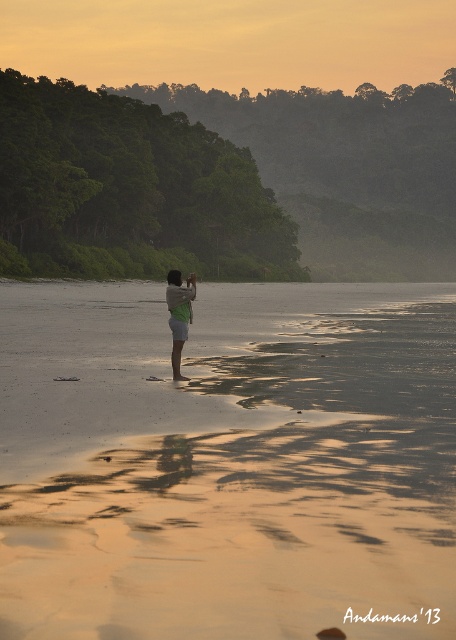
Question: Which point is farther to the camera?

Choices:
 (A) (186, 330)
 (B) (397, 618)

Answer: (A)

Question: Which point is closer to the camera?

Choices:
 (A) (223, 419)
 (B) (179, 301)

Answer: (A)

Question: Does sandy beach at center have a lesser width compared to green fabric shorts at center?

Choices:
 (A) no
 (B) yes

Answer: (A)

Question: Does sandy beach at center have a lesser width compared to green fabric shorts at center?

Choices:
 (A) no
 (B) yes

Answer: (A)

Question: Can you confirm if sandy beach at center is wider than green fabric shorts at center?

Choices:
 (A) no
 (B) yes

Answer: (B)